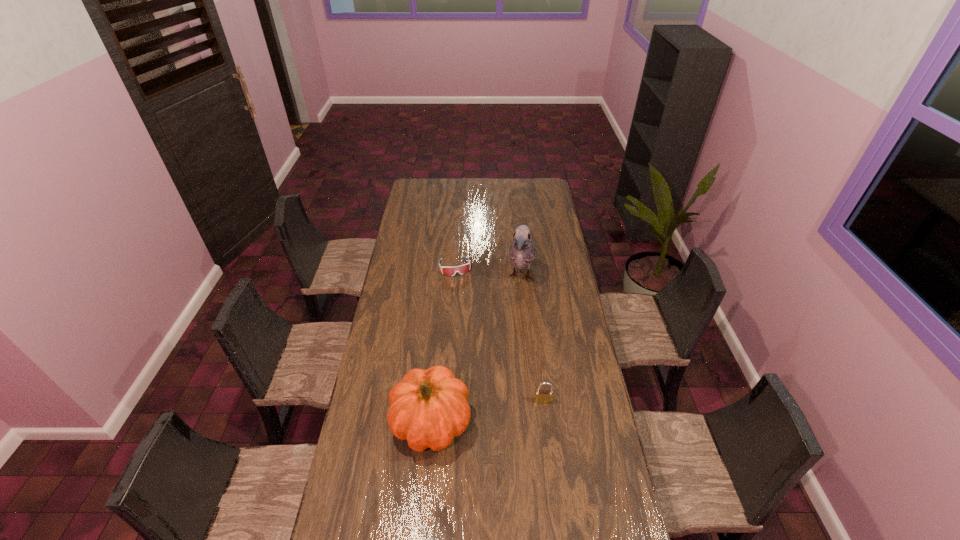
Locate an element on the screen. This screenshot has width=960, height=540. free space located on the front-facing side of the shortest object is located at coordinates point(463,295).

This screenshot has width=960, height=540. I want to click on vacant space situated 0.250m on the front-facing side of the shortest object, so click(x=468, y=313).

This screenshot has width=960, height=540. In order to click on object that is at the left edge in this screenshot , I will do `click(430, 407)`.

Locate an element on the screen. The height and width of the screenshot is (540, 960). vacant space at the far edge of the desktop is located at coordinates (464, 190).

Image resolution: width=960 pixels, height=540 pixels. I want to click on free region at the near edge, so click(x=405, y=535).

Find the location of a particular element. blank space at the left edge of the desktop is located at coordinates (405, 295).

Locate an element on the screen. vacant space at the right edge is located at coordinates click(x=545, y=249).

I want to click on free space at the near right corner of the desktop, so click(626, 534).

Find the location of `empty space that is in between the tallest object and the goggles`. empty space that is in between the tallest object and the goggles is located at coordinates (488, 272).

The image size is (960, 540). Identify the location of free space between the pumpkin and the goggles. tap(444, 345).